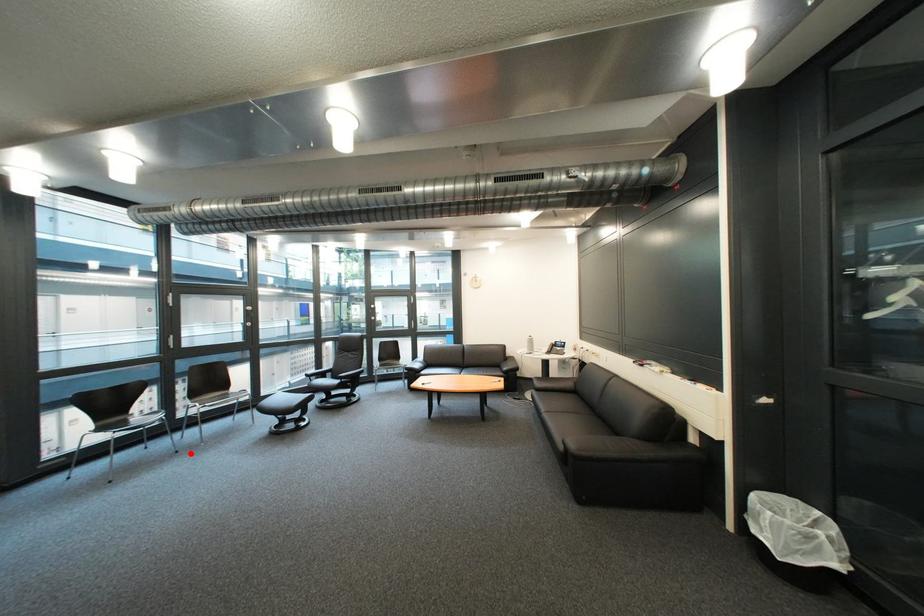
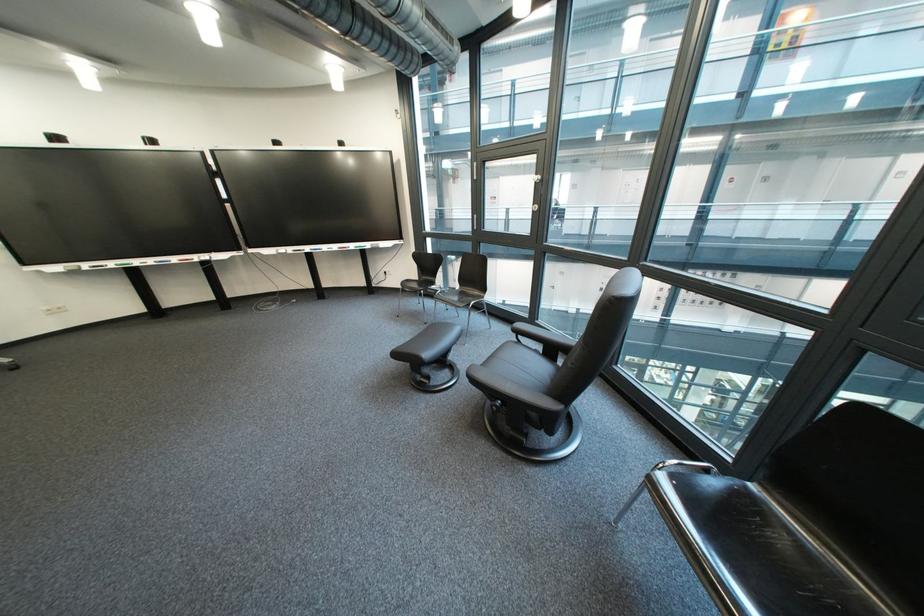
Locate, in the second image, the point that corresponds to the highlighted location in the first image.

(439, 325)